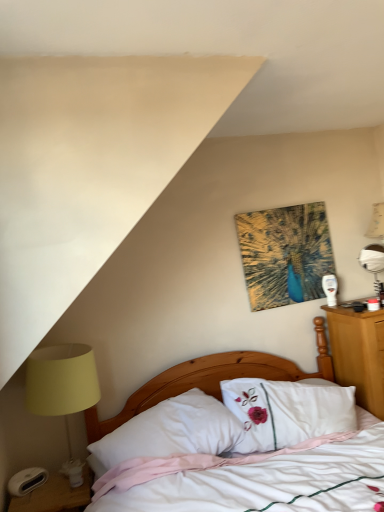
Question: From the image's perspective, is matte yellow lampshade at left below abstract painting at upper center?

Choices:
 (A) no
 (B) yes

Answer: (B)

Question: Can you confirm if matte yellow lampshade at left is positioned to the left of abstract painting at upper center?

Choices:
 (A) no
 (B) yes

Answer: (B)

Question: Does matte yellow lampshade at left have a lesser width compared to abstract painting at upper center?

Choices:
 (A) no
 (B) yes

Answer: (A)

Question: Is matte yellow lampshade at left not within abstract painting at upper center?

Choices:
 (A) no
 (B) yes

Answer: (B)

Question: Is matte yellow lampshade at left at the right side of abstract painting at upper center?

Choices:
 (A) no
 (B) yes

Answer: (A)

Question: Looking at their shapes, would you say abstract painting at upper center is wider or thinner than metallic silver table lamp at right?

Choices:
 (A) wide
 (B) thin

Answer: (B)

Question: Would you say abstract painting at upper center is to the left or to the right of metallic silver table lamp at right in the picture?

Choices:
 (A) left
 (B) right

Answer: (A)

Question: Is abstract painting at upper center bigger or smaller than metallic silver table lamp at right?

Choices:
 (A) small
 (B) big

Answer: (B)

Question: Is abstract painting at upper center situated inside metallic silver table lamp at right or outside?

Choices:
 (A) outside
 (B) inside

Answer: (A)

Question: Based on their positions, is white glossy nightstand at lower left located to the left or right of abstract painting at upper center?

Choices:
 (A) left
 (B) right

Answer: (A)

Question: From a real-world perspective, is white glossy nightstand at lower left positioned above or below abstract painting at upper center?

Choices:
 (A) above
 (B) below

Answer: (B)

Question: From the image's perspective, relative to abstract painting at upper center, is white glossy nightstand at lower left above or below?

Choices:
 (A) above
 (B) below

Answer: (B)

Question: Does point (29, 496) appear closer or farther from the camera than point (253, 271)?

Choices:
 (A) closer
 (B) farther

Answer: (A)

Question: Would you say white soft pillow at center is to the left or to the right of matte yellow lampshade at left in the picture?

Choices:
 (A) left
 (B) right

Answer: (B)

Question: Is white soft pillow at center situated inside matte yellow lampshade at left or outside?

Choices:
 (A) outside
 (B) inside

Answer: (A)